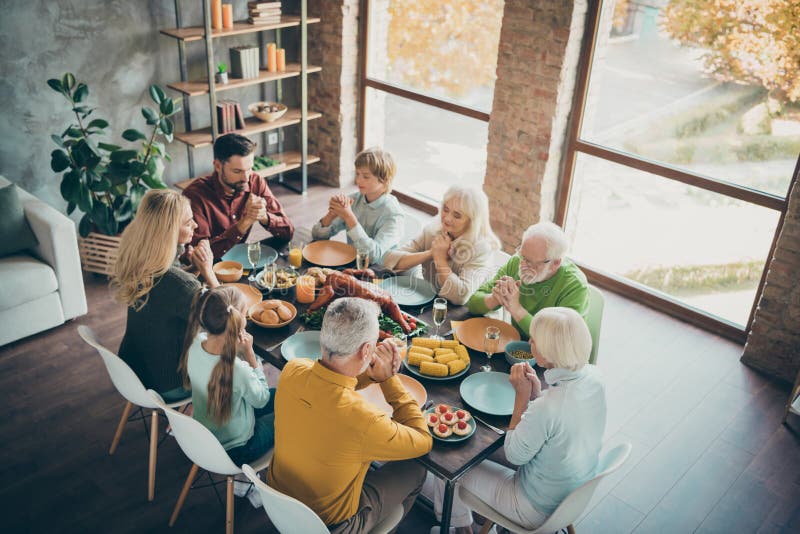
Where is `shelves on book shelf`? The image size is (800, 534). shelves on book shelf is located at coordinates (288, 169), (272, 128), (260, 89), (244, 27).